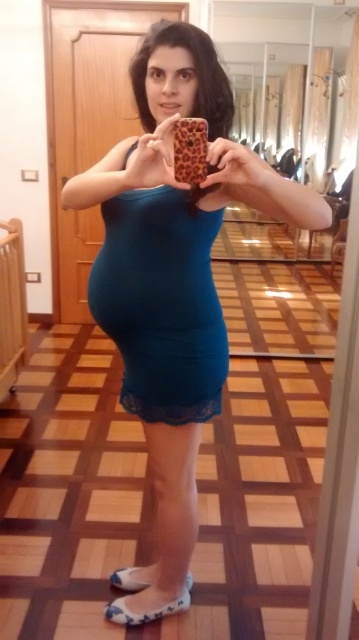
Question: Does blue fabric sandal at lower center have a smaller size compared to white fabric sandal at lower center?

Choices:
 (A) no
 (B) yes

Answer: (A)

Question: In this image, where is teal matte dress at center located relative to white fabric sandal at lower center?

Choices:
 (A) right
 (B) left

Answer: (A)

Question: Which point appears closest to the camera in this image?

Choices:
 (A) (138, 301)
 (B) (142, 584)
 (C) (179, 604)
 (D) (170, 275)

Answer: (D)

Question: Among these points, which one is farthest from the camera?

Choices:
 (A) coord(132,292)
 (B) coord(150,182)
 (C) coord(120,586)

Answer: (C)

Question: Does teal fabric dress at center have a greater width compared to white fabric sandal at lower center?

Choices:
 (A) no
 (B) yes

Answer: (B)

Question: Which point appears closest to the camera in this image?

Choices:
 (A) [188, 580]
 (B) [179, 442]
 (C) [106, 612]
 (D) [184, 310]

Answer: (D)